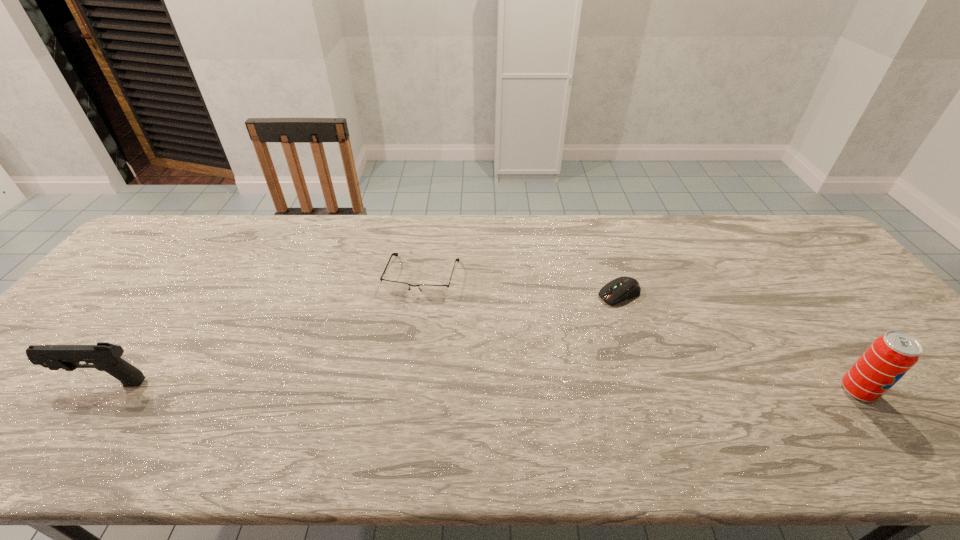
The height and width of the screenshot is (540, 960). Identify the location of vacant space situated on the front-facing side of the second object from left to right. (379, 400).

Where is `vacant position located 0.050m on the front-facing side of the second object from left to right`? This screenshot has width=960, height=540. vacant position located 0.050m on the front-facing side of the second object from left to right is located at coordinates (410, 311).

Where is `free spot located 0.310m on the front-facing side of the second object from left to right`? Image resolution: width=960 pixels, height=540 pixels. free spot located 0.310m on the front-facing side of the second object from left to right is located at coordinates (381, 393).

You are a GUI agent. You are given a task and a screenshot of the screen. Output one action in this format:
    pyautogui.click(x=<x>, y=<y>)
    Task: Click on the object located in the far edge section of the desktop
    The height and width of the screenshot is (540, 960).
    Given the screenshot: What is the action you would take?
    pyautogui.click(x=435, y=291)

This screenshot has width=960, height=540. I want to click on pistol at the near edge, so click(x=104, y=356).

What are the coordinates of `soda can situated at the near edge` in the screenshot? It's located at (890, 356).

I want to click on object located in the left edge section of the desktop, so click(104, 356).

Identify the location of object located in the near left corner section of the desktop. (104, 356).

Where is `free region at the far edge`? free region at the far edge is located at coordinates (645, 226).

This screenshot has height=540, width=960. Find the location of `free location at the near edge`. free location at the near edge is located at coordinates (780, 390).